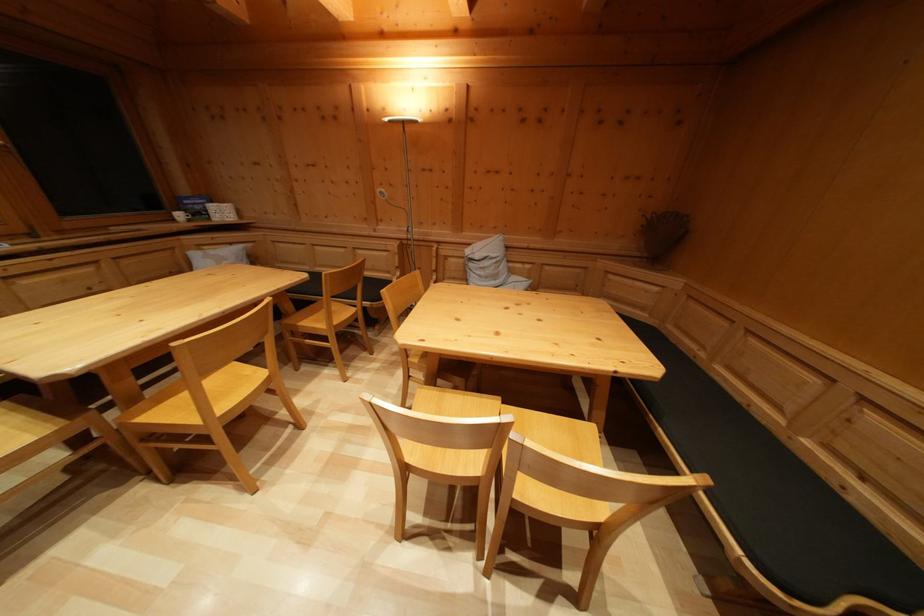
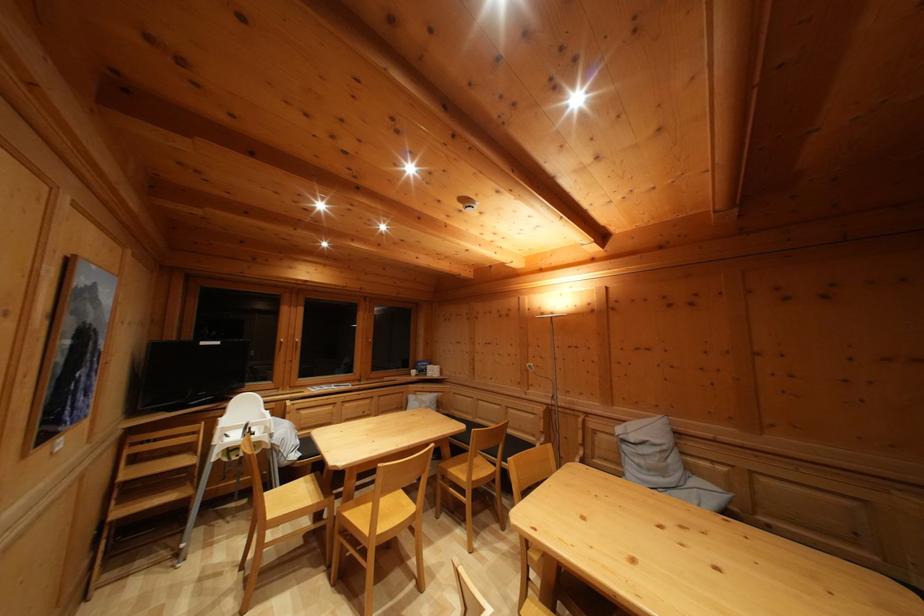
In the second image, find the point that corresponds to point 200,428 in the first image.

(371, 537)